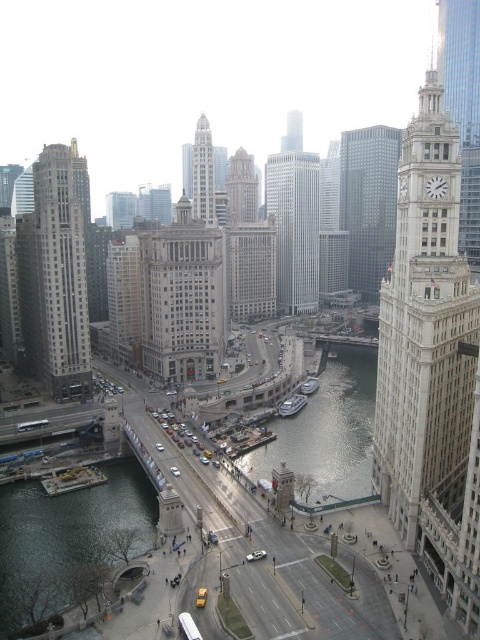
Is point (75, 518) positioned after point (374, 148)?

No, (75, 518) is in front of (374, 148).

Based on the photo, is greenish water at lower left taller than glassy steel skyscraper at center?

In fact, greenish water at lower left may be shorter than glassy steel skyscraper at center.

Describe the element at coordinates (64, 536) in the screenshot. I see `greenish water at lower left` at that location.

Identify the location of greenish water at lower left. Image resolution: width=480 pixels, height=640 pixels. (64, 536).

Between beige stone building at center and matte gold building at center, which one has less height?

matte gold building at center

Does beige stone building at center have a greater height compared to matte gold building at center?

Correct, beige stone building at center is much taller as matte gold building at center.

Does point (216, 372) come in front of point (237, 152)?

Yes, it is in front of point (237, 152).

You are a GUI agent. You are given a task and a screenshot of the screen. Output one action in this format:
    pyautogui.click(x=<x>, y=<y>)
    Task: Click on the beige stone building at center
    The width and height of the screenshot is (480, 640).
    Given the screenshot: What is the action you would take?
    pyautogui.click(x=182, y=300)

Which is behind, point (55, 596) or point (354, 417)?

Point (354, 417)

The width and height of the screenshot is (480, 640). Find the location of `greenish water at lower left`. greenish water at lower left is located at coordinates (64, 536).